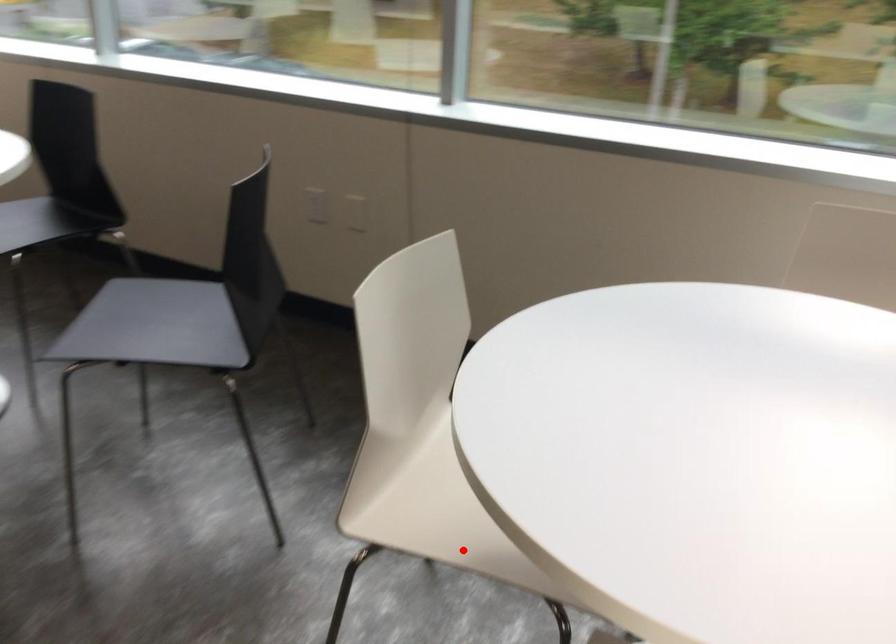
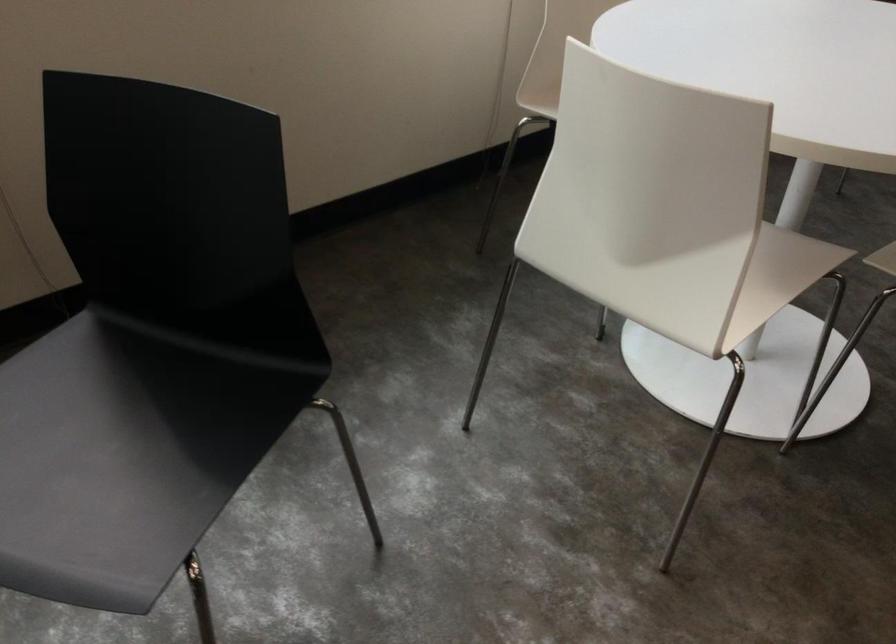
Find the pixel in the second image that matches the highlighted location in the first image.

(777, 277)